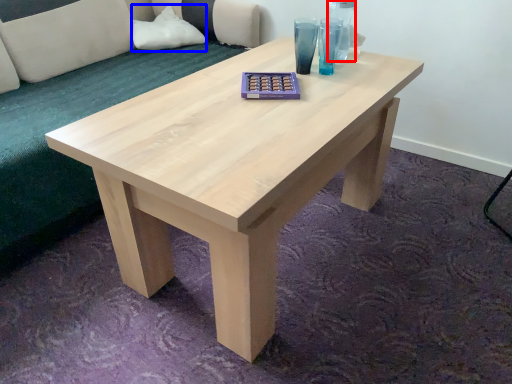
Question: Which of the following is the farthest to the observer, glass vase (highlighted by a red box) or pillow (highlighted by a blue box)?

Choices:
 (A) glass vase
 (B) pillow

Answer: (B)